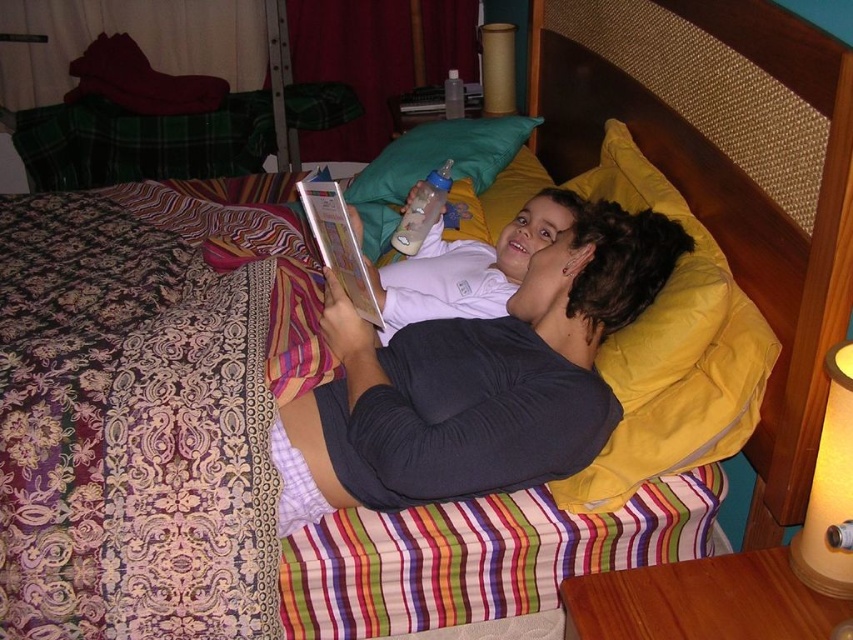
Is yellow fabric lampshade at right positioned before matte brown cylinder at upper center?

Yes, yellow fabric lampshade at right is closer to the viewer.

Which is more to the left, yellow fabric lampshade at right or matte brown cylinder at upper center?

From the viewer's perspective, matte brown cylinder at upper center appears more on the left side.

Find the location of a particular element. Image resolution: width=853 pixels, height=640 pixels. yellow fabric lampshade at right is located at coordinates (830, 490).

Can you confirm if dark gray sweater at center is wider than yellow fabric pillow at upper right?

Yes, dark gray sweater at center is wider than yellow fabric pillow at upper right.

What do you see at coordinates (474, 381) in the screenshot?
I see `dark gray sweater at center` at bounding box center [474, 381].

This screenshot has width=853, height=640. What do you see at coordinates (474, 381) in the screenshot?
I see `dark gray sweater at center` at bounding box center [474, 381].

Image resolution: width=853 pixels, height=640 pixels. I want to click on dark gray sweater at center, so 474,381.

How far apart are yellow fabric pillow at upper right and yellow fabric lampshade at right?

They are 16.14 inches apart.

Describe the element at coordinates (671, 349) in the screenshot. I see `yellow fabric pillow at upper right` at that location.

In order to click on yellow fabric pillow at upper right in this screenshot , I will do `click(671, 349)`.